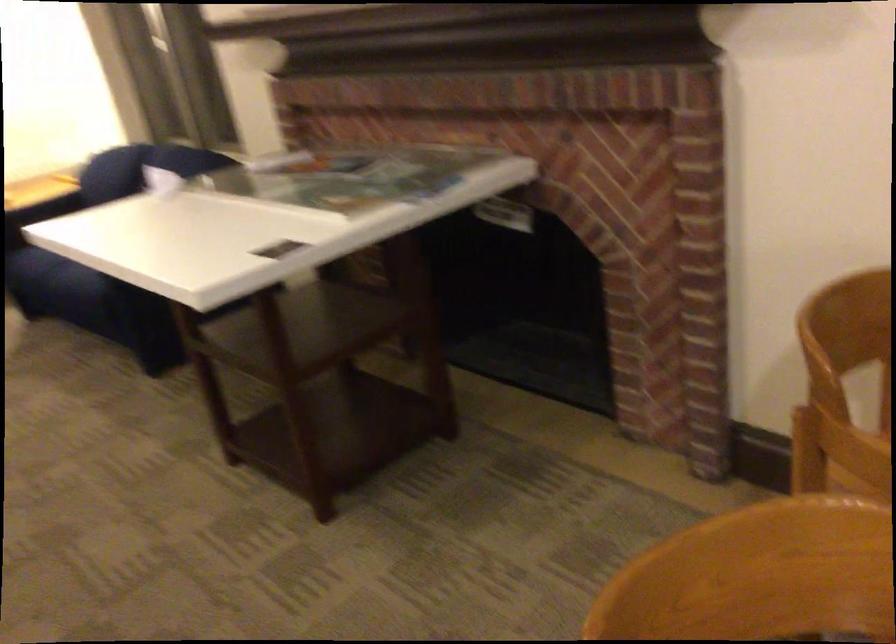
Find where to sit the sofa sitting surface. Please return your answer as a coordinate pair (x, y).

(38, 216)